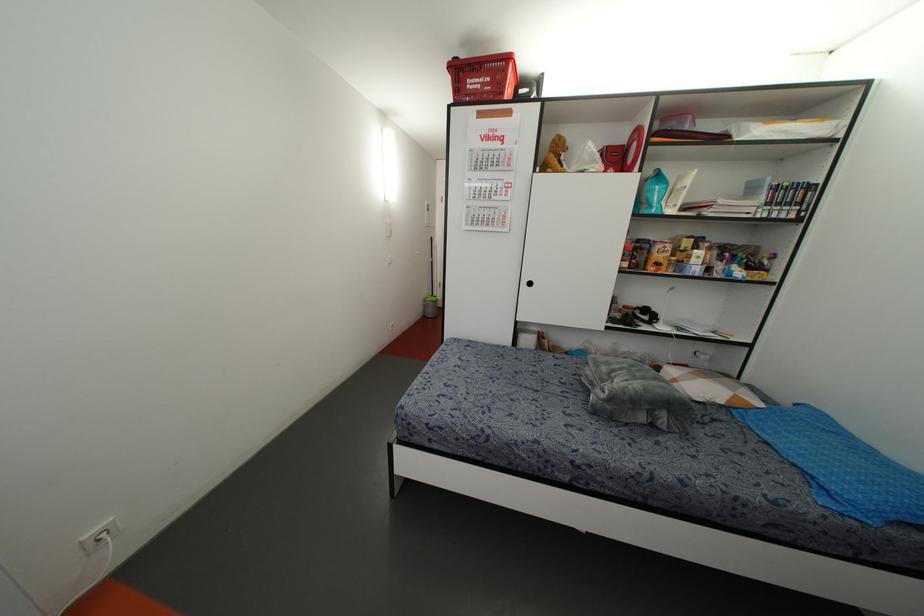
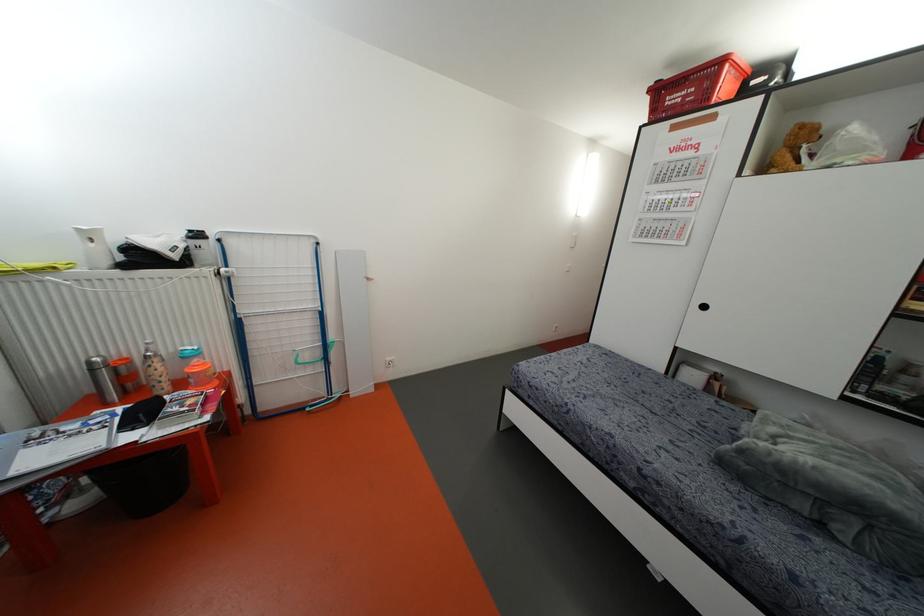
Find the pixel in the second image that matches (x=507, y=58) in the first image.

(723, 60)